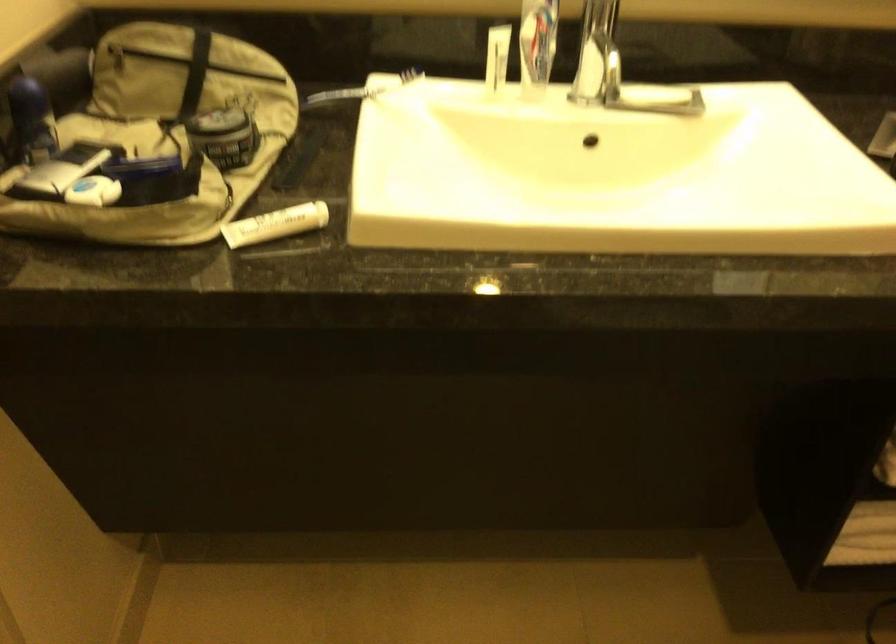
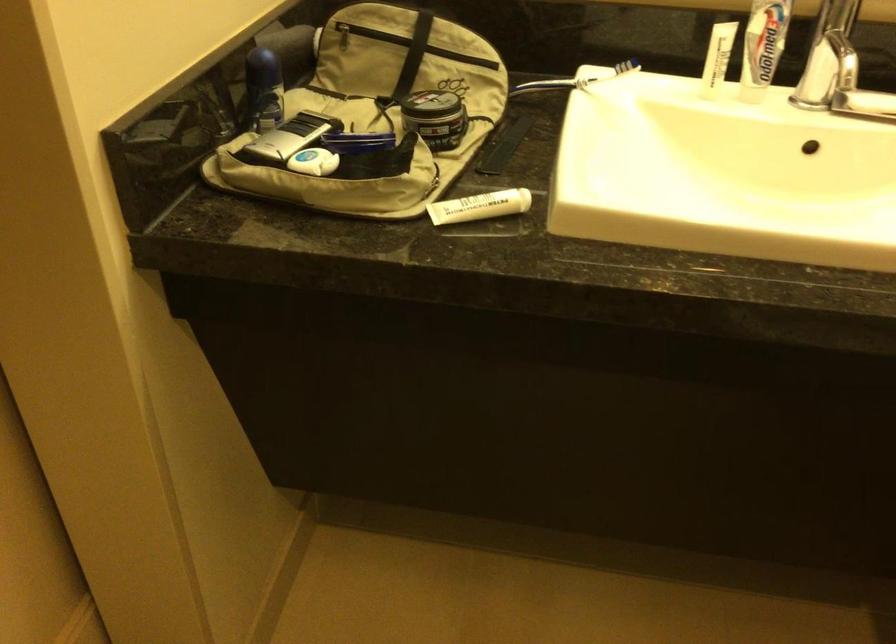
Where in the second image is the point corresponding to point 273,225 from the first image?

(479, 205)